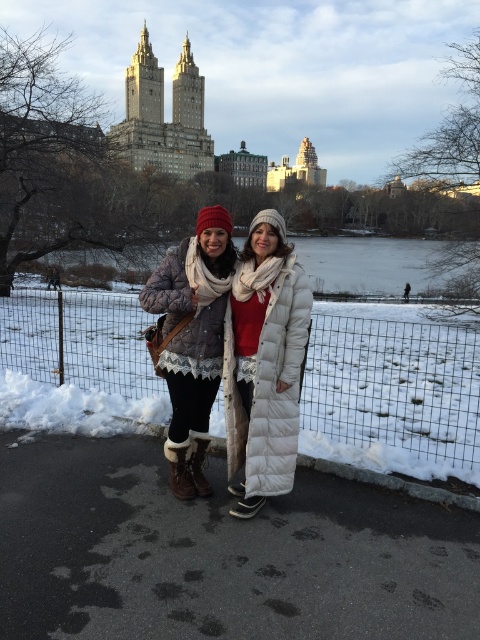
You are standing at the point marked by coordinates point (x=277, y=401) in the winter scene of Central Park. You want to walk to the iconic Twin Towers of the San Remo building in the background. If the distance between you and the viewer is 32.49 meters, can you estimate how far you are from the Twin Towers?

The distance between you and the viewer is 32.49 meters, but the exact distance to the Twin Towers cannot be determined from the given information. The provided data only specifies the distance between the point and the viewer, not the distance from the point to the Twin Towers.